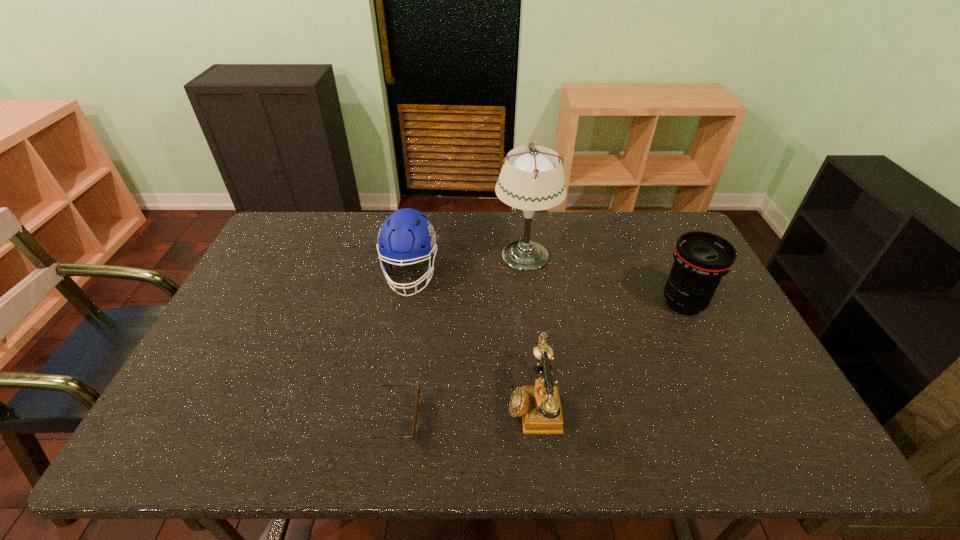
The height and width of the screenshot is (540, 960). I want to click on vacant region that satisfies the following two spatial constraints: 1. on the front side of the telephoto lens; 2. at the front view of the spectacles, so click(x=740, y=420).

Image resolution: width=960 pixels, height=540 pixels. Identify the location of vacant area in the image that satisfies the following two spatial constraints: 1. on the front side of the telephoto lens; 2. at the front view of the shortest object. (740, 420).

The image size is (960, 540). Find the location of `vacant area in the image that satisfies the following two spatial constraints: 1. on the lampshade of the rightmost object; 2. on the right side of the tallest object`. vacant area in the image that satisfies the following two spatial constraints: 1. on the lampshade of the rightmost object; 2. on the right side of the tallest object is located at coordinates (531, 303).